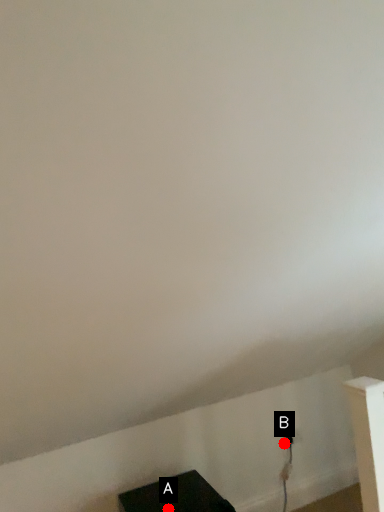
Question: Two points are circled on the image, labeled by A and B beside each circle. Which point appears farthest from the camera in this image?

Choices:
 (A) A is further
 (B) B is further

Answer: (B)